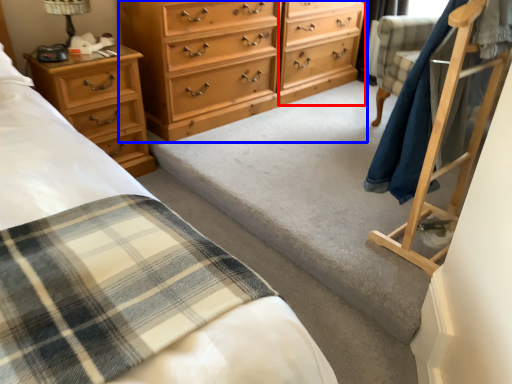
Question: Which object is closer to the camera taking this photo, file cabinet (highlighted by a red box) or chest of drawers (highlighted by a blue box)?

Choices:
 (A) file cabinet
 (B) chest of drawers

Answer: (B)